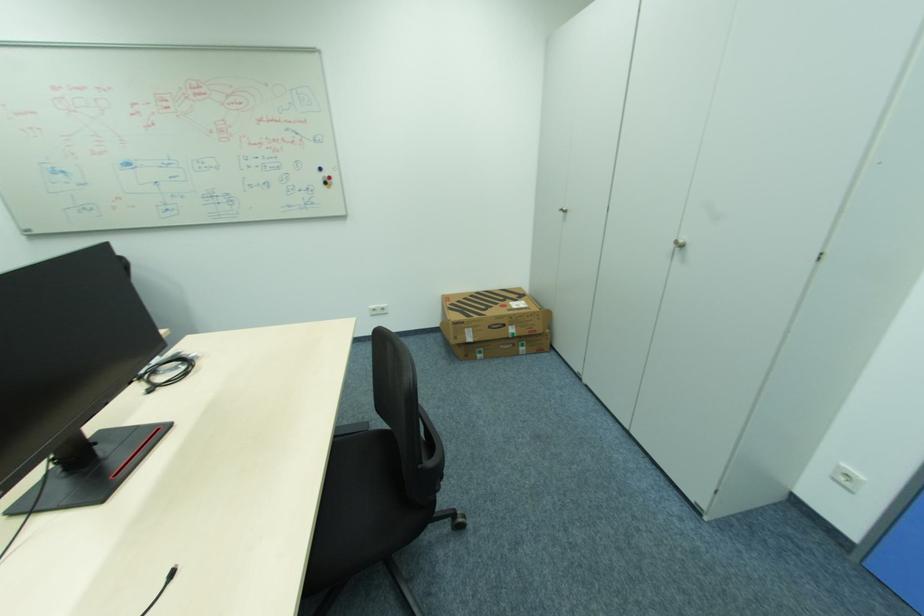
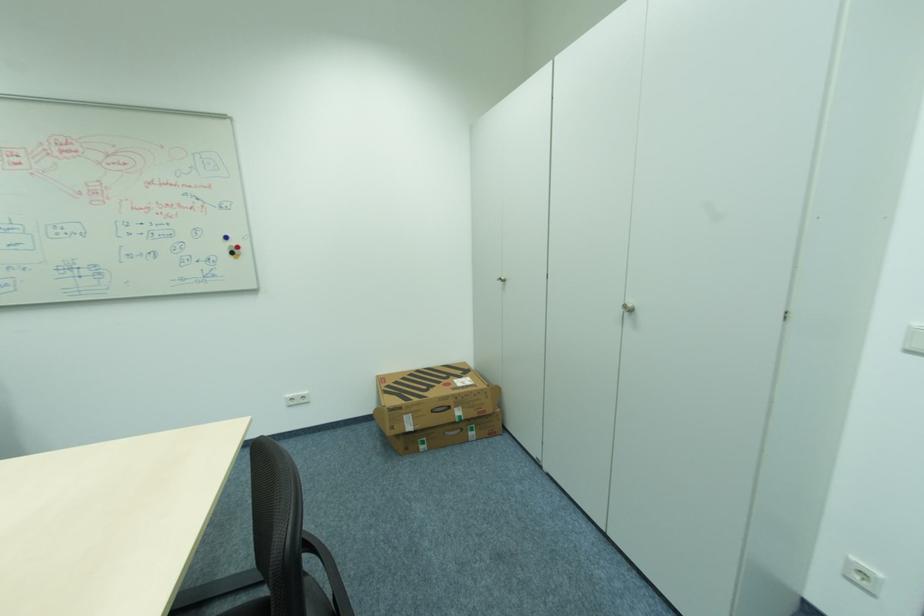
Question: Based on the continuous images, in which direction is the camera rotating? Reply with the corresponding letter.

Choices:
 (A) Left
 (B) Right
 (C) Up
 (D) Down

Answer: (C)